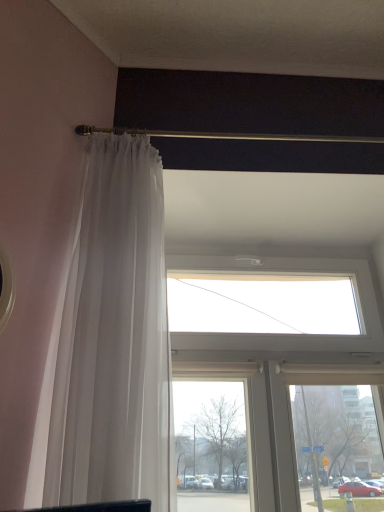
Where is `transparent glass window at upper center`? The image size is (384, 512). transparent glass window at upper center is located at coordinates (278, 373).

From a real-world perspective, who is located higher, transparent glass window at upper center or sheer white curtain at left?

sheer white curtain at left.

Which object is positioned more to the left, transparent glass window at upper center or sheer white curtain at left?

From the viewer's perspective, sheer white curtain at left appears more on the left side.

Considering their positions, is transparent glass window at upper center located in front of or behind sheer white curtain at left?

Visually, transparent glass window at upper center is located behind sheer white curtain at left.

Is sheer white curtain at left completely or partially inside transparent glass window at upper center?

Actually, sheer white curtain at left is outside transparent glass window at upper center.

Is sheer white curtain at left inside gold metallic rod at upper center?

No, sheer white curtain at left is located outside of gold metallic rod at upper center.

From their relative heights in the image, would you say gold metallic rod at upper center is taller or shorter than sheer white curtain at left?

Clearly, gold metallic rod at upper center is shorter compared to sheer white curtain at left.

Image resolution: width=384 pixels, height=512 pixels. I want to click on curtain on the left of the gold metallic rod at upper center, so click(x=111, y=340).

Is gold metallic rod at upper center oriented away from sheer white curtain at left?

No.

From the image's perspective, is sheer white curtain at left positioned above or below gold metallic rod at upper center?

Based on their image positions, sheer white curtain at left is located beneath gold metallic rod at upper center.

Considering the positions of objects sheer white curtain at left and gold metallic rod at upper center in the image provided, who is behind, sheer white curtain at left or gold metallic rod at upper center?

gold metallic rod at upper center is further away from the camera.

Locate an element on the screen. The height and width of the screenshot is (512, 384). beam positioned vertically above the sheer white curtain at left (from a real-world perspective) is located at coordinates (227, 135).

Would you consider transparent glass window at upper center to be distant from gold metallic rod at upper center?

transparent glass window at upper center is near gold metallic rod at upper center, not far away.

Considering the relative positions of transparent glass window at upper center and gold metallic rod at upper center in the image provided, is transparent glass window at upper center to the right of gold metallic rod at upper center from the viewer's perspective?

Indeed, transparent glass window at upper center is positioned on the right side of gold metallic rod at upper center.

Between transparent glass window at upper center and gold metallic rod at upper center, which one has less height?

gold metallic rod at upper center is shorter.

Is transparent glass window at upper center thinner than gold metallic rod at upper center?

Incorrect, the width of transparent glass window at upper center is not less than that of gold metallic rod at upper center.

Which of these two, sheer white curtain at left or transparent glass window at upper center, is bigger?

transparent glass window at upper center.

In the scene shown: Is sheer white curtain at left placed right next to transparent glass window at upper center?

There is a gap between sheer white curtain at left and transparent glass window at upper center.

Is sheer white curtain at left in front of transparent glass window at upper center?

Yes, sheer white curtain at left is in front of transparent glass window at upper center.

Is gold metallic rod at upper center to the right of transparent glass window at upper center from the viewer's perspective?

No, gold metallic rod at upper center is not to the right of transparent glass window at upper center.

Between point (313, 135) and point (353, 446), which one is positioned in front?

Point (353, 446)

Is gold metallic rod at upper center taller than transparent glass window at upper center?

Incorrect, the height of gold metallic rod at upper center is not larger of that of transparent glass window at upper center.

How different are the orientations of gold metallic rod at upper center and transparent glass window at upper center in degrees?

The angle between the facing direction of gold metallic rod at upper center and the facing direction of transparent glass window at upper center is 0.00105 degrees.

Locate an element on the screen. This screenshot has height=512, width=384. curtain positioned vertically above the transparent glass window at upper center (from a real-world perspective) is located at coordinates (111, 340).

This screenshot has width=384, height=512. Find the location of `beam behind the sheer white curtain at left`. beam behind the sheer white curtain at left is located at coordinates (227, 135).

Looking at the image, which one is located further to transparent glass window at upper center, gold metallic rod at upper center or sheer white curtain at left?

gold metallic rod at upper center is positioned further to the anchor transparent glass window at upper center.

Estimate the real-world distances between objects in this image. Which object is further from sheer white curtain at left, transparent glass window at upper center or gold metallic rod at upper center?

Among the two, transparent glass window at upper center is located further to sheer white curtain at left.

Considering their positions, is sheer white curtain at left positioned further to gold metallic rod at upper center than transparent glass window at upper center?

Based on the image, transparent glass window at upper center appears to be further to gold metallic rod at upper center.

Which object lies nearer to the anchor point transparent glass window at upper center, sheer white curtain at left or gold metallic rod at upper center?

sheer white curtain at left is positioned closer to the anchor transparent glass window at upper center.

Looking at the image, which one is located further to gold metallic rod at upper center, transparent glass window at upper center or sheer white curtain at left?

transparent glass window at upper center lies further to gold metallic rod at upper center than the other object.

Based on their spatial positions, is gold metallic rod at upper center or transparent glass window at upper center further from sheer white curtain at left?

transparent glass window at upper center is positioned further to the anchor sheer white curtain at left.

This screenshot has width=384, height=512. In order to click on curtain between gold metallic rod at upper center and transparent glass window at upper center in the up-down direction in this screenshot , I will do `click(111, 340)`.